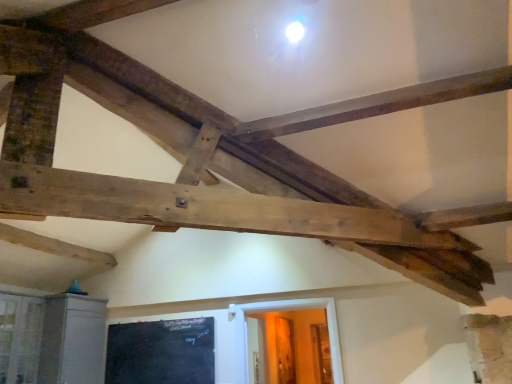
Question: From a real-world perspective, relative to black chalkboard at lower left, is white wooden door at lower center vertically above or below?

Choices:
 (A) below
 (B) above

Answer: (A)

Question: Is white wooden door at lower center wider or thinner than black chalkboard at lower left?

Choices:
 (A) thin
 (B) wide

Answer: (B)

Question: Which object is the closest to the black chalkboard at lower left?

Choices:
 (A) clear glass window at lower left
 (B) white wooden door at lower center

Answer: (A)

Question: Which is farther from the black chalkboard at lower left?

Choices:
 (A) white wooden door at lower center
 (B) clear glass window at lower left

Answer: (A)